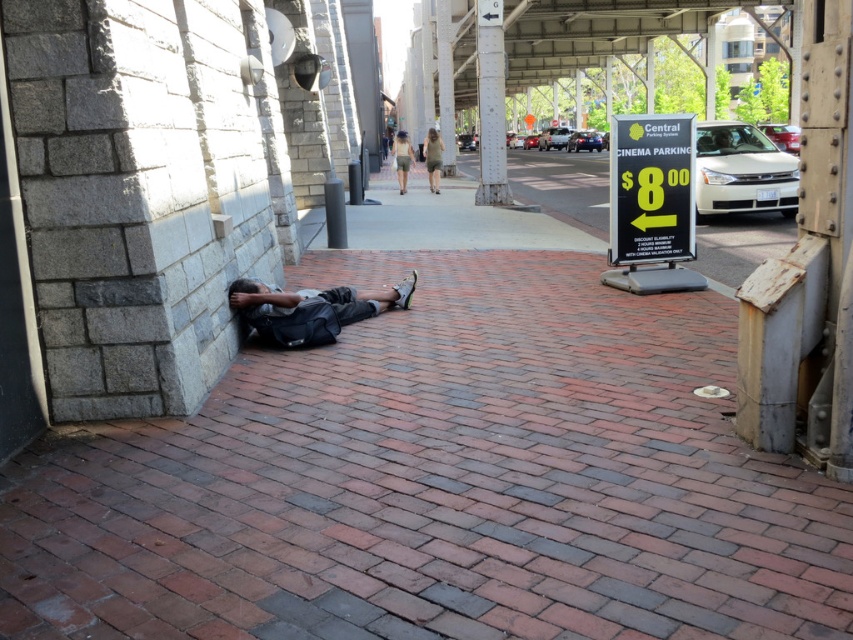
Question: Can you confirm if dark gray fabric bag at center is positioned to the right of khaki shorts at center?

Choices:
 (A) no
 (B) yes

Answer: (B)

Question: Is matte gray dress at center wider than khaki shorts at center?

Choices:
 (A) yes
 (B) no

Answer: (B)

Question: Which object is closer to the camera taking this photo?

Choices:
 (A) khaki shorts at center
 (B) matte gray dress at center
 (C) dark gray fabric bag at center

Answer: (C)

Question: In this image, where is dark gray fabric bag at center located relative to matte gray dress at center?

Choices:
 (A) above
 (B) below

Answer: (B)

Question: Considering the real-world distances, which object is farthest from the white painted metal pole at upper center?

Choices:
 (A) khaki shorts at center
 (B) matte gray dress at center

Answer: (A)

Question: Estimate the real-world distances between objects in this image. Which object is closer to the khaki shorts at center?

Choices:
 (A) white painted metal pole at upper center
 (B) dark gray fabric bag at center
 (C) matte gray dress at center

Answer: (C)